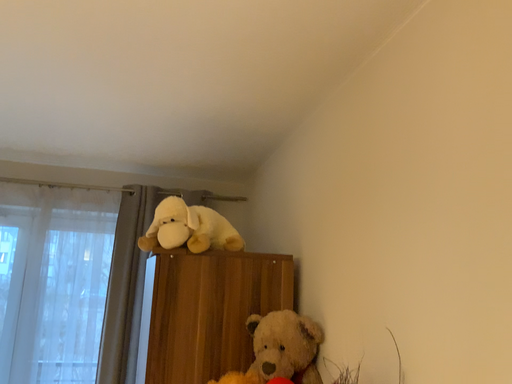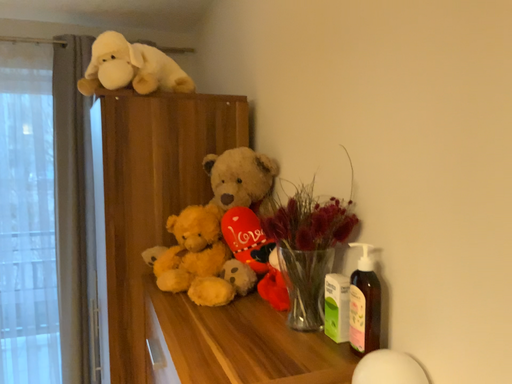
Question: Which way did the camera rotate in the video?

Choices:
 (A) rotated left
 (B) rotated right

Answer: (B)